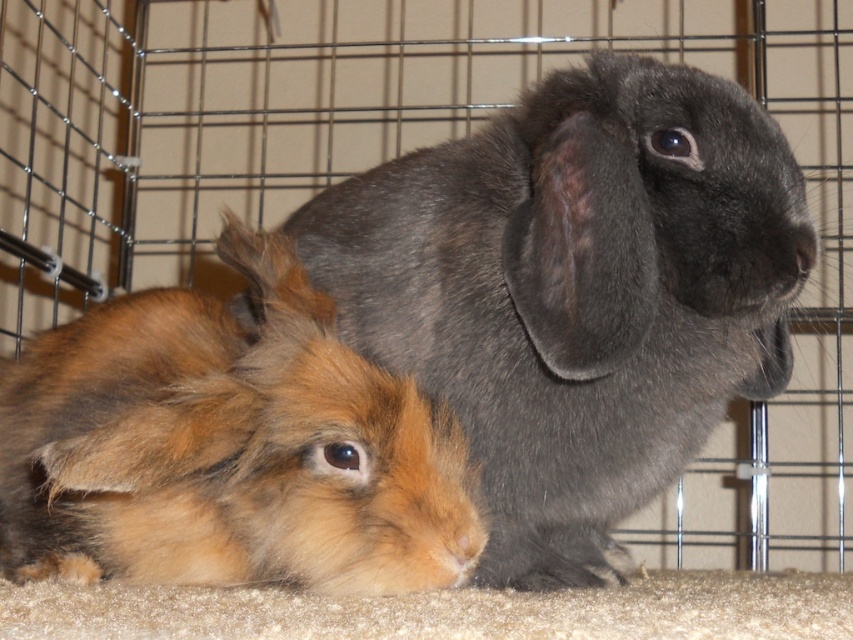
From the picture: Can you confirm if gray soft fur rabbit at center is taller than brown fluffy rabbit at lower left?

Yes, gray soft fur rabbit at center is taller than brown fluffy rabbit at lower left.

Between gray soft fur rabbit at center and brown fluffy rabbit at lower left, which one has less height?

brown fluffy rabbit at lower left is shorter.

Is point (700, 227) closer to viewer compared to point (416, 531)?

That is False.

This screenshot has width=853, height=640. Identify the location of gray soft fur rabbit at center. (577, 291).